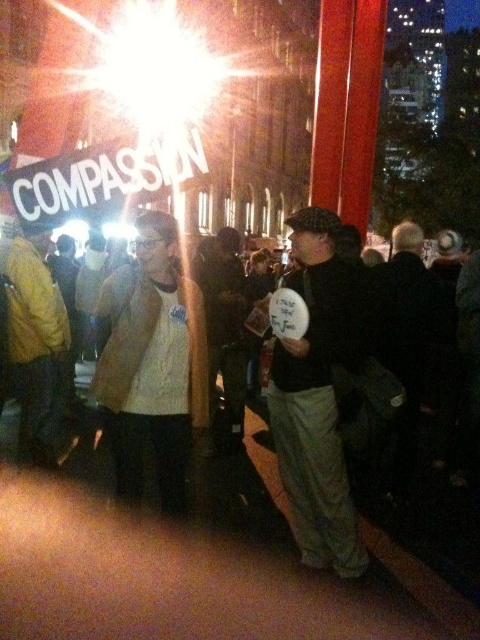
Question: Estimate the real-world distances between objects in this image. Which object is closer to the light brown leather jacket at center?

Choices:
 (A) matte black shirt at center
 (B) yellow fabric jacket at left

Answer: (B)

Question: Is matte black shirt at center below light brown leather jacket at center?

Choices:
 (A) yes
 (B) no

Answer: (A)

Question: Which point is farther to the camera?

Choices:
 (A) (58, 356)
 (B) (99, 301)
 (C) (287, 468)

Answer: (A)

Question: From the image, what is the correct spatial relationship of matte black shirt at center in relation to yellow fabric jacket at left?

Choices:
 (A) below
 (B) above

Answer: (A)

Question: Which is farther from the matte black shirt at center?

Choices:
 (A) yellow fabric jacket at left
 (B) light brown leather jacket at center

Answer: (A)

Question: Can you confirm if light brown leather jacket at center is positioned above yellow fabric jacket at left?

Choices:
 (A) no
 (B) yes

Answer: (A)